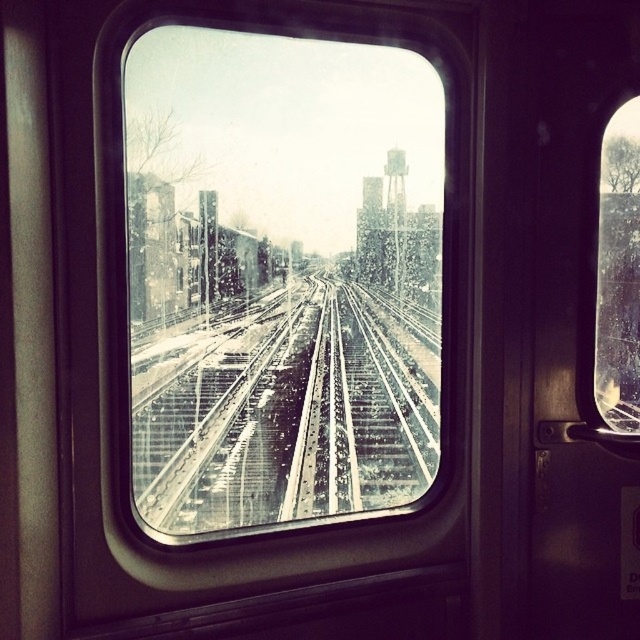
Who is positioned more to the left, metal/textured tracks at center or transparent glass window at right?

metal/textured tracks at center

Is metal/textured tracks at center smaller than transparent glass window at right?

Incorrect, metal/textured tracks at center is not smaller in size than transparent glass window at right.

Between point (170, 524) and point (605, 268), which one is positioned behind?

The point (605, 268) is more distant.

At what (x,y) coordinates should I click in order to perform the action: click on metal/textured tracks at center. Please return your answer as a coordinate pair (x, y). Looking at the image, I should click on pyautogui.click(x=308, y=419).

Does metallic glass train window at center come behind transparent glass window at right?

That is False.

Does point (278, 520) lie behind point (636, 170)?

Yes, point (278, 520) is farther from viewer.

This screenshot has height=640, width=640. I want to click on metallic glass train window at center, so click(x=282, y=276).

Consider the image. Can you confirm if metallic glass train window at center is taller than metal/textured tracks at center?

Correct, metallic glass train window at center is much taller as metal/textured tracks at center.

Is point (244, 97) positioned after point (392, 396)?

No, (244, 97) is in front of (392, 396).

The image size is (640, 640). What are the coordinates of `metallic glass train window at center` in the screenshot? It's located at (282, 276).

You are a GUI agent. You are given a task and a screenshot of the screen. Output one action in this format:
    pyautogui.click(x=<x>, y=<y>)
    Task: Click on the metallic glass train window at center
    
    Given the screenshot: What is the action you would take?
    click(282, 276)